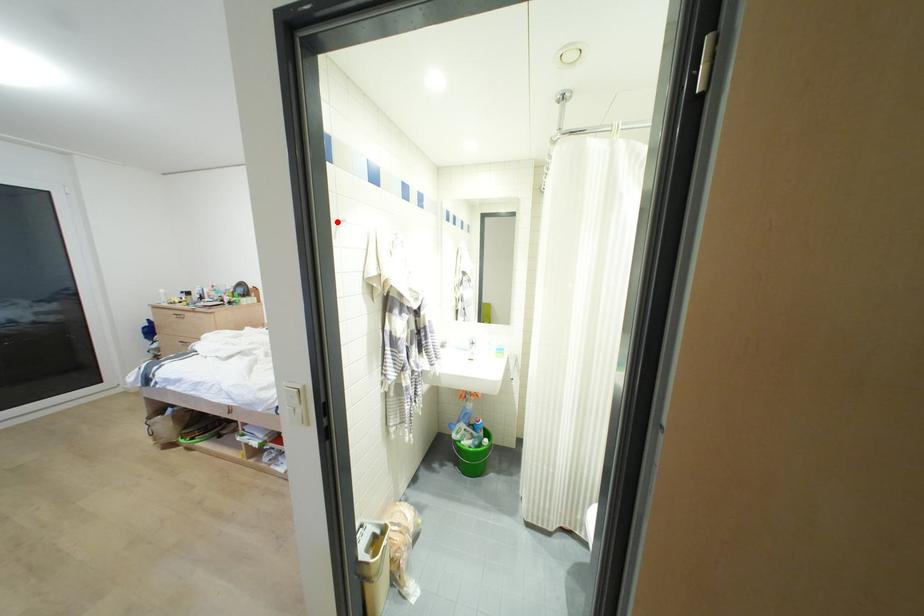
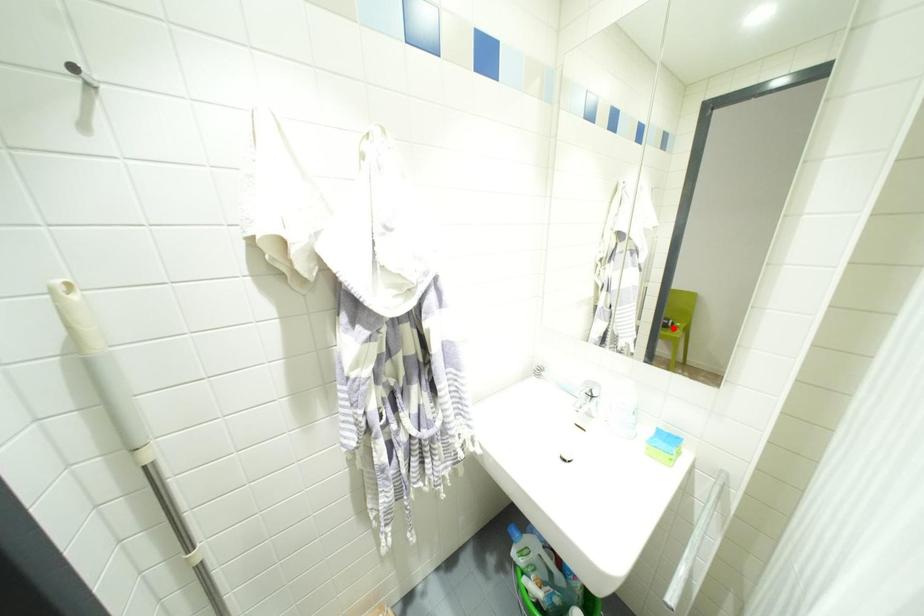
I am providing you with two images of the same scene from different viewpoints. A red point is marked on the first image and another point is marked on the second image. Is the red point in image1 aligned with the point shown in image2?

No